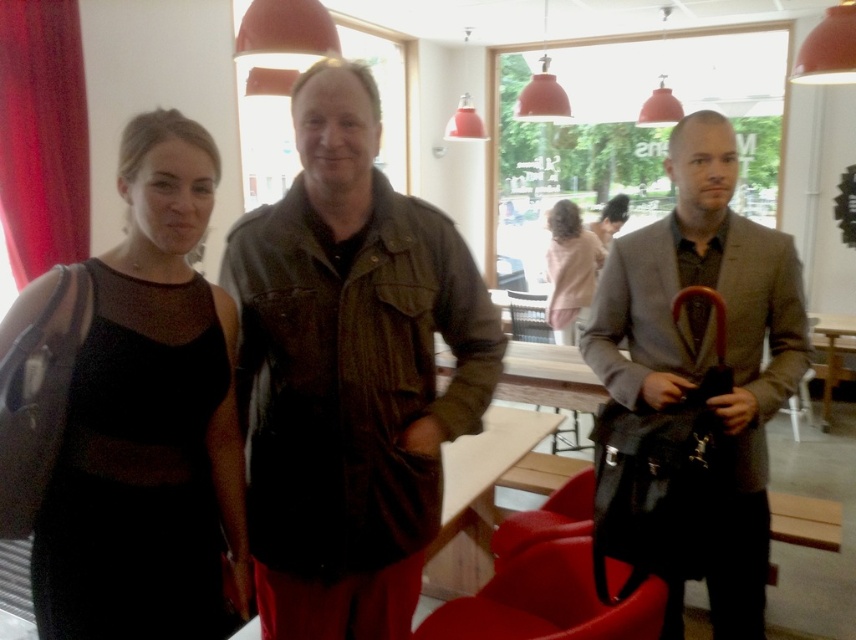
You are a photographer standing in front of the three people in the image. You want to take a closeup shot of the leather jacket at center and the light pink sweater at center. Which one will appear larger in your photo?

The leather jacket at center will appear larger in the photo because it is closer to the viewer than the light pink sweater at center.

What object is located at the coordinates point (349, 372) in the image?

The point (349, 372) is on the leather jacket at center.

In the scene shown: You are a photographer setting up a shoot in this scene. You need to ensure that the leather jacket at center and the black matte dress at left are visible in the frame. Based on their sizes, which object should you prioritize positioning closer to the camera to maintain clarity?

The leather jacket at center should be positioned closer to the camera because it is taller than the black matte dress at left, ensuring both remain visible and clear in the frame.